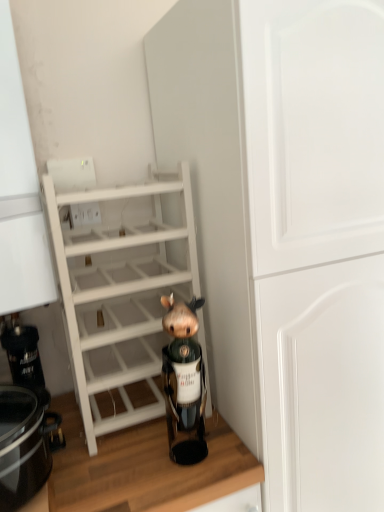
Question: Can you confirm if wooden at lower center is smaller than brown matte figurine at center?

Choices:
 (A) yes
 (B) no

Answer: (B)

Question: Does wooden at lower center appear on the left side of brown matte figurine at center?

Choices:
 (A) yes
 (B) no

Answer: (A)

Question: Is brown matte figurine at center at the back of wooden at lower center?

Choices:
 (A) no
 (B) yes

Answer: (A)

Question: Can you confirm if wooden at lower center is thinner than brown matte figurine at center?

Choices:
 (A) yes
 (B) no

Answer: (B)

Question: Does wooden at lower center come in front of brown matte figurine at center?

Choices:
 (A) no
 (B) yes

Answer: (B)

Question: Is wooden at lower center taller than brown matte figurine at center?

Choices:
 (A) no
 (B) yes

Answer: (B)

Question: From a real-world perspective, is wooden at lower center located higher than white matte cabinet at center?

Choices:
 (A) yes
 (B) no

Answer: (B)

Question: Is wooden at lower center completely or partially outside of white matte cabinet at center?

Choices:
 (A) no
 (B) yes

Answer: (B)

Question: Is the surface of wooden at lower center in direct contact with white matte cabinet at center?

Choices:
 (A) no
 (B) yes

Answer: (A)

Question: Can you confirm if wooden at lower center is positioned to the right of white matte cabinet at center?

Choices:
 (A) yes
 (B) no

Answer: (B)

Question: Could you tell me if wooden at lower center is facing white matte cabinet at center?

Choices:
 (A) yes
 (B) no

Answer: (B)

Question: Can you confirm if wooden at lower center is bigger than white matte cabinet at center?

Choices:
 (A) yes
 (B) no

Answer: (B)

Question: Can you confirm if brown matte figurine at center is shorter than black glossy crock pot at lower left?

Choices:
 (A) yes
 (B) no

Answer: (B)